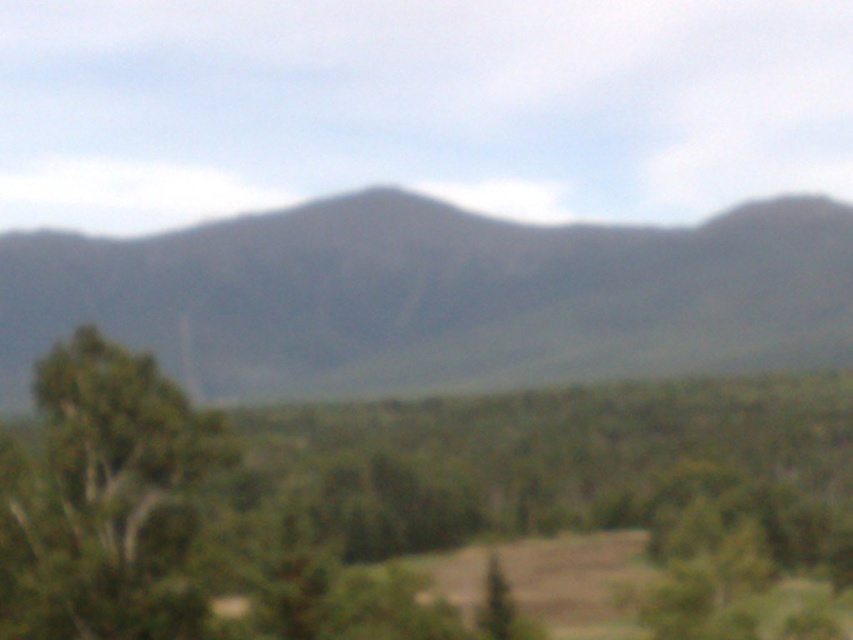
Question: Can you confirm if gray matte mountain at center is thinner than green leafy tree at left?

Choices:
 (A) no
 (B) yes

Answer: (A)

Question: From the image, what is the correct spatial relationship of green leafy tree at center in relation to gray matte mountain at center?

Choices:
 (A) right
 (B) left

Answer: (A)

Question: Which object is positioned closest to the gray matte mountain at center?

Choices:
 (A) green leafy tree at center
 (B) green leafy tree at left

Answer: (A)

Question: Which object is farther from the camera taking this photo?

Choices:
 (A) green leafy tree at left
 (B) green leafy tree at center
 (C) gray matte mountain at center

Answer: (C)

Question: Which point is farther to the camera?

Choices:
 (A) green leafy tree at center
 (B) green leafy tree at left
 (C) gray matte mountain at center

Answer: (C)

Question: Is green leafy tree at center closer to the viewer compared to green leafy tree at left?

Choices:
 (A) yes
 (B) no

Answer: (B)